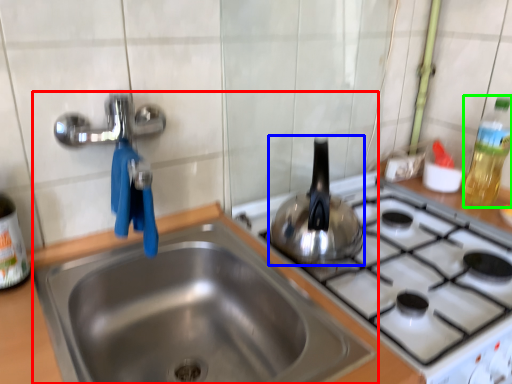
Question: Which is farther away from sink (highlighted by a red box)? tea pot (highlighted by a blue box) or bottle (highlighted by a green box)?

Choices:
 (A) tea pot
 (B) bottle

Answer: (B)